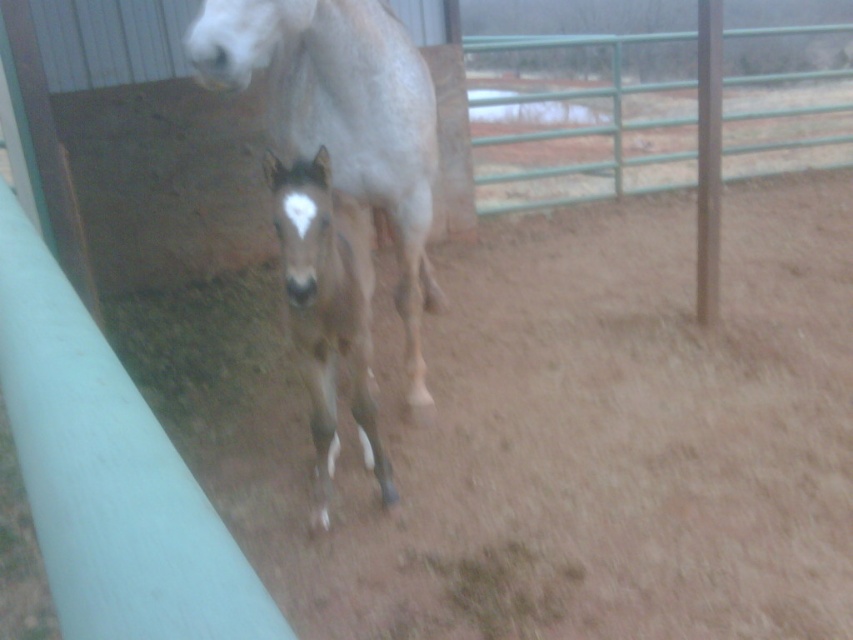
You are a farmer checking the enclosure for space. The brown matte horse at center and brown speckled coat at center are both inside. Which one is wider?

The brown matte horse at center is wider than the brown speckled coat at center.

You are a zookeeper observing the enclosure. You notice the brown matte horse at center and the brown speckled coat at center. Which horse is positioned closer to the left side of the enclosure?

The brown matte horse at center is positioned to the left of the brown speckled coat at center, so it is closer to the left side of the enclosure.

You are a farmer checking the enclosure. You notice the brown matte horse at center and the brown speckled coat at center. Which one is bigger in size?

The brown matte horse at center is larger in size than the brown speckled coat at center.